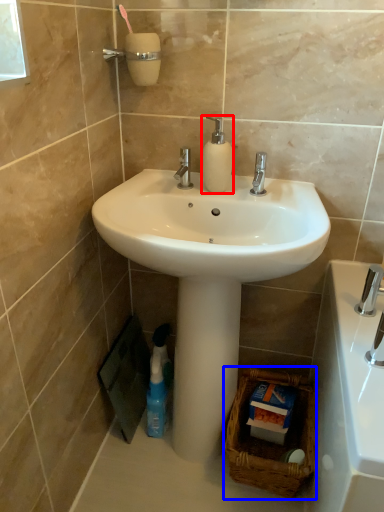
Question: Which object appears closest to the camera in this image, soap dispenser (highlighted by a red box) or basket (highlighted by a blue box)?

Choices:
 (A) soap dispenser
 (B) basket

Answer: (A)